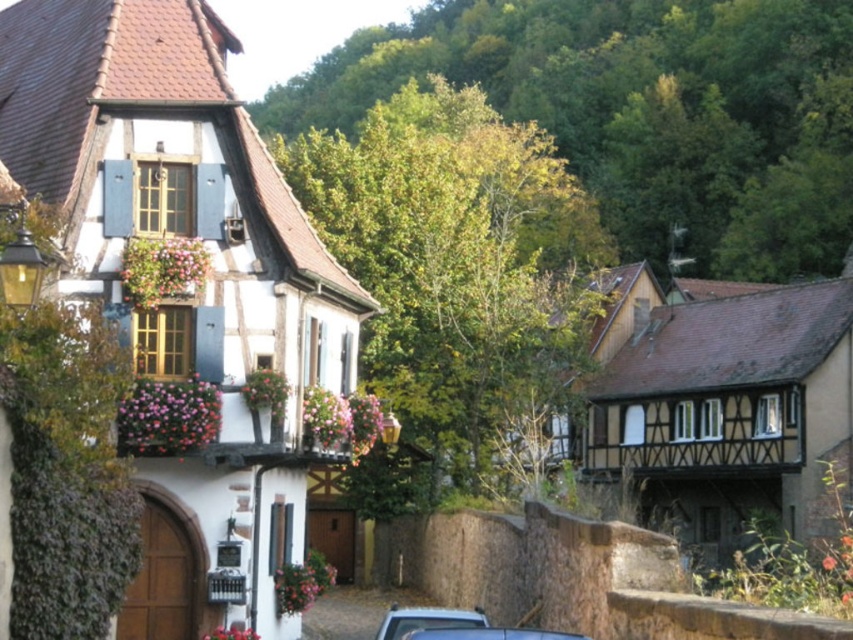
You are standing at the camera position and want to take a photo of the white wood house at left. If your camera has a maximum focus range of 30 meters, will it be able to capture the house clearly?

The white wood house at left and camera are 29.06 meters apart from each other. Since the distance is within the camera maximum focus range of 30 meters, the camera can capture the house clearly.

You are standing at the center of the village square, which is located at point coordinates of 0.5, 0.5. You want to walk to the white wood house at left. In which direction should you walk to reach it?

The white wood house at left is located at point coordinates of [187,289]. Since the village square is at [426,320], you should walk towards the northwest direction to reach the white wood house at left.